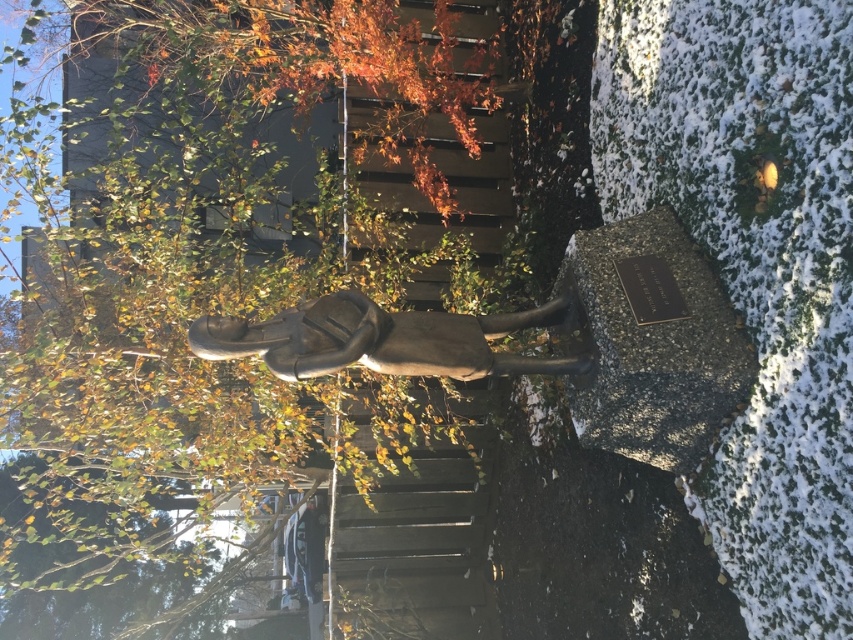
You are an artist planning to sketch this scene. You want to ensure the proportions between the green leafy tree at upper left and the bronze statue at center are accurate. Which object should you draw wider?

The green leafy tree at upper left should be drawn wider because its width is larger than the bronze statue at center.

Looking at this image, you are standing at the base of the bronze statue at center and want to touch the green leafy tree at upper left. Can you reach it without moving from your current position?

The green leafy tree at upper left is 6.57 feet away from bronze statue at center, so you cannot reach it without moving from your current position since the distance is greater than an average person can reach.

You are standing in front of the bronze statue at center and want to climb up the metallic stairwell at center. Can you reach the top of the stairwell without any assistance?

The metallic stairwell at center is taller than bronze statue at center, so if the statue is about 2 meters tall, the stairwell would be taller than that. Therefore, you might need assistance to reach the top of the metallic stairwell at center.